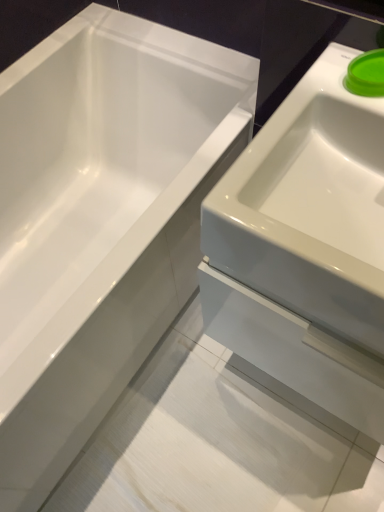
Question: From the image's perspective, is green plastic lid at upper right under white glossy bathtub at upper left?

Choices:
 (A) no
 (B) yes

Answer: (A)

Question: From a real-world perspective, does green plastic lid at upper right stand above white glossy bathtub at upper left?

Choices:
 (A) no
 (B) yes

Answer: (B)

Question: Considering the relative sizes of green plastic lid at upper right and white glossy bathtub at upper left in the image provided, is green plastic lid at upper right taller than white glossy bathtub at upper left?

Choices:
 (A) no
 (B) yes

Answer: (A)

Question: Is green plastic lid at upper right turned away from white glossy bathtub at upper left?

Choices:
 (A) yes
 (B) no

Answer: (B)

Question: Can you confirm if green plastic lid at upper right is positioned to the right of white glossy bathtub at upper left?

Choices:
 (A) no
 (B) yes

Answer: (B)

Question: From the image's perspective, is white glossy bathtub at upper left positioned above or below white glossy sink at right?

Choices:
 (A) above
 (B) below

Answer: (A)

Question: Is point (134, 60) closer or farther from the camera than point (314, 317)?

Choices:
 (A) closer
 (B) farther

Answer: (B)

Question: Choose the correct answer: Is white glossy bathtub at upper left inside white glossy sink at right or outside it?

Choices:
 (A) outside
 (B) inside

Answer: (A)

Question: Considering the positions of white glossy bathtub at upper left and white glossy sink at right in the image, is white glossy bathtub at upper left bigger or smaller than white glossy sink at right?

Choices:
 (A) big
 (B) small

Answer: (A)

Question: Choose the correct answer: Is white glossy sink at right inside green plastic lid at upper right or outside it?

Choices:
 (A) inside
 (B) outside

Answer: (B)

Question: Would you say white glossy sink at right is to the left or to the right of green plastic lid at upper right in the picture?

Choices:
 (A) right
 (B) left

Answer: (A)

Question: In the image, is white glossy sink at right positioned in front of or behind green plastic lid at upper right?

Choices:
 (A) front
 (B) behind

Answer: (A)

Question: From the image's perspective, is white glossy sink at right located above or below green plastic lid at upper right?

Choices:
 (A) above
 (B) below

Answer: (B)

Question: From a real-world perspective, is green plastic lid at upper right physically located above or below white glossy bathtub at upper left?

Choices:
 (A) below
 (B) above

Answer: (B)

Question: Would you say green plastic lid at upper right is to the left or to the right of white glossy bathtub at upper left in the picture?

Choices:
 (A) right
 (B) left

Answer: (A)